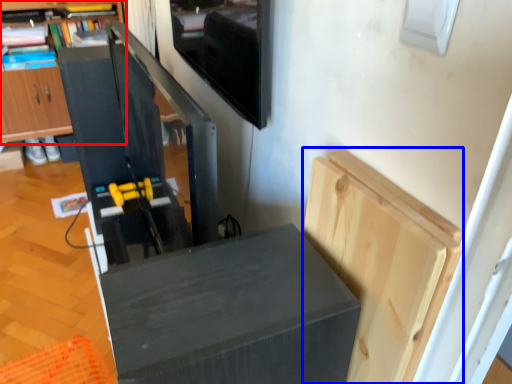
Question: Among these objects, which one is nearest to the camera, cabinetry (highlighted by a red box) or cabinetry (highlighted by a blue box)?

Choices:
 (A) cabinetry
 (B) cabinetry

Answer: (B)